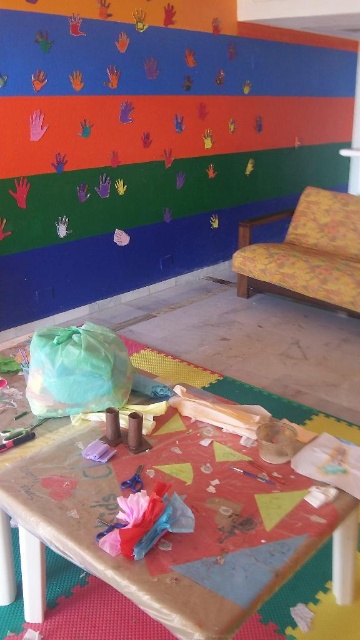
Question: Which point is farther to the camera?

Choices:
 (A) (69, 556)
 (B) (304, 250)

Answer: (B)

Question: Can you confirm if wrinkled brown paper at center is positioned to the left of yellow floral fabric sofa at right?

Choices:
 (A) no
 (B) yes

Answer: (B)

Question: Which point is farther from the camera taking this photo?

Choices:
 (A) (59, 570)
 (B) (263, 280)

Answer: (B)

Question: Does wrinkled brown paper at center have a greater width compared to yellow floral fabric sofa at right?

Choices:
 (A) yes
 (B) no

Answer: (A)

Question: Where is wrinkled brown paper at center located in relation to yellow floral fabric sofa at right in the image?

Choices:
 (A) right
 (B) left

Answer: (B)

Question: Which object is farther from the camera taking this photo?

Choices:
 (A) wrinkled brown paper at center
 (B) yellow floral fabric sofa at right

Answer: (B)